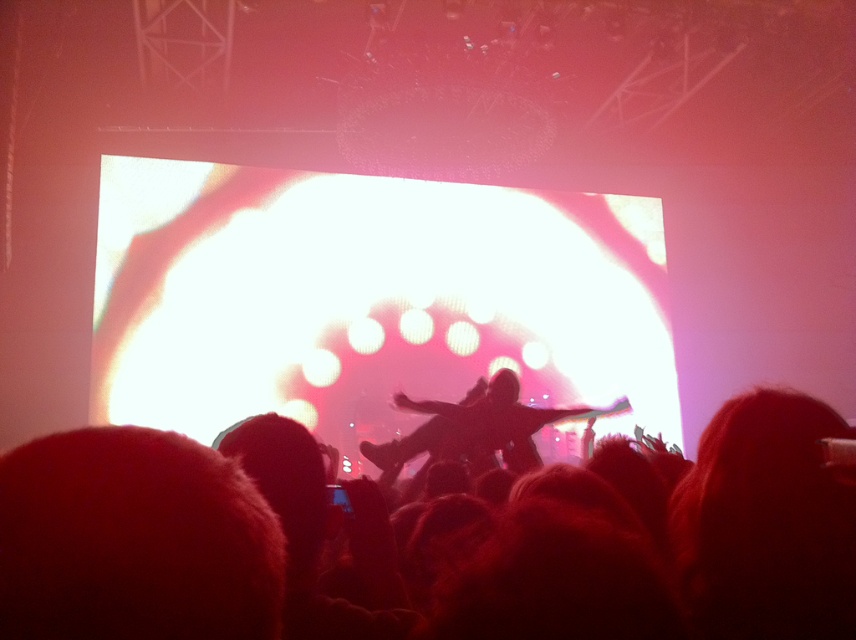
You are a photographer at the concert and want to capture the silhouette figure at center and silhouette hair at center in a single frame. The camera you have can only focus on objects wider than 10 cm. Can both objects be captured clearly in the photo?

The silhouette hair at center is narrower than the silhouette figure at center. Since the camera requires objects to be wider than 10 cm for clear focus, only the silhouette figure at center meets this requirement. The silhouette hair at center may be too narrow to be captured clearly.

Based on the photo, you are a photographer at the concert and want to capture the silhouette hair at center. Where should you position your camera to ensure it is centered in the photo?

The silhouette hair at center is located at point 0.817 on the x and 0.897 on the y axis, so positioning the camera directly facing that coordinate will center it in the photo.

You are a photographer at the concert and want to capture the silhouette figure at center and silhouette hair at center in a way that highlights their position relative to each other. Based on their arrangement, which one should you focus on first to ensure both are in frame?

The silhouette hair at center is above the silhouette figure at center. To ensure both are in frame, focus on the silhouette figure at center first, as it is lower and the hair will naturally be captured above it.